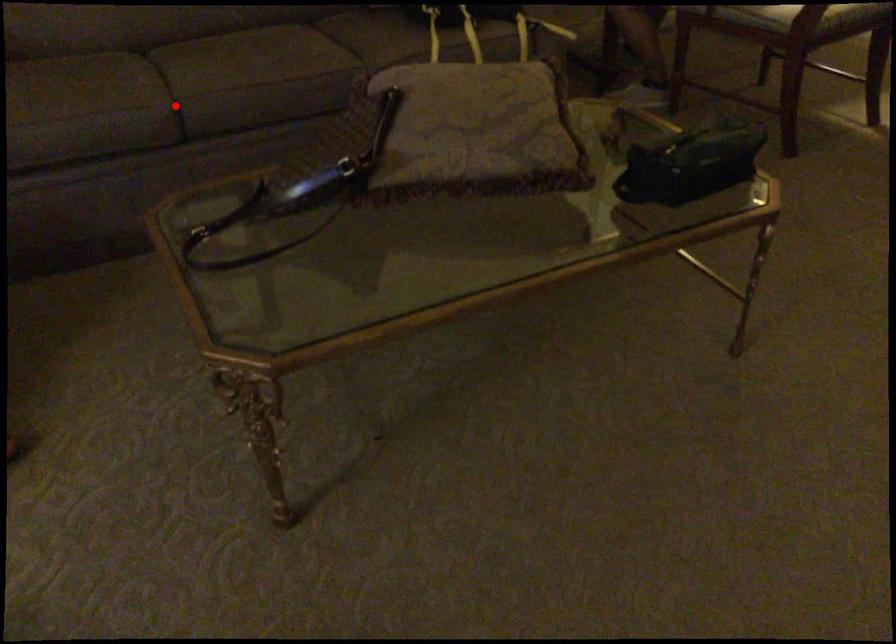
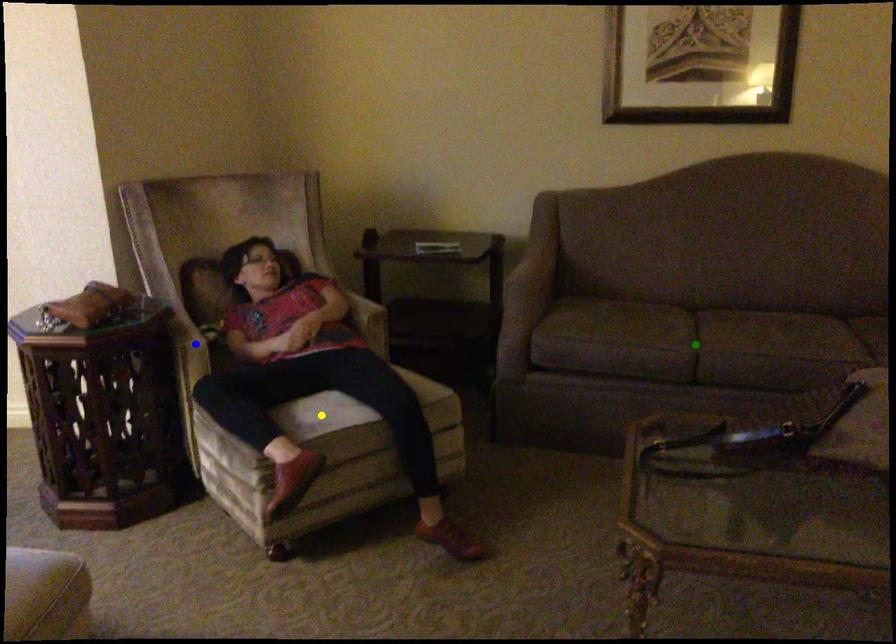
Question: I am providing you with two images of the same scene from different viewpoints. A red point is marked on the first image. You are given multiple points on the second image. Can you choose the point in image 2 that corresponds to the point in image 1?

Choices:
 (A) yellow point
 (B) blue point
 (C) green point

Answer: (C)